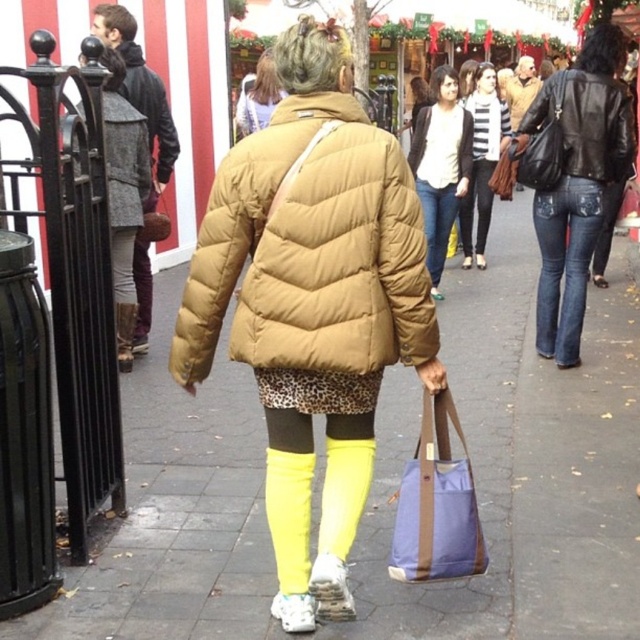
Describe the element at coordinates (390, 483) in the screenshot. The width and height of the screenshot is (640, 640). I see `matte concrete pavement at center` at that location.

Can you confirm if matte concrete pavement at center is positioned to the left of gray wool coat at left?

No, matte concrete pavement at center is not to the left of gray wool coat at left.

Measure the distance between matte concrete pavement at center and camera.

matte concrete pavement at center and camera are 5.00 meters apart from each other.

Where is `matte concrete pavement at center`? This screenshot has height=640, width=640. matte concrete pavement at center is located at coordinates (390, 483).

Between leather boots at left and yellow rubber rain boot at left, which one is positioned lower?

yellow rubber rain boot at left is lower down.

Is point (125, 104) positioned in front of point (129, 328)?

Yes, point (125, 104) is in front of point (129, 328).

Is point (124, 337) in front of point (128, 342)?

Yes, point (124, 337) is in front of point (128, 342).

Identify the location of leather boots at left. The image size is (640, 640). (124, 196).

Which is above, matte white shirt at center or jeans at center?

matte white shirt at center is higher up.

Is point (435, 211) positioned in front of point (436, 227)?

Yes, it is.

Find the location of a particular element. matte white shirt at center is located at coordinates (440, 164).